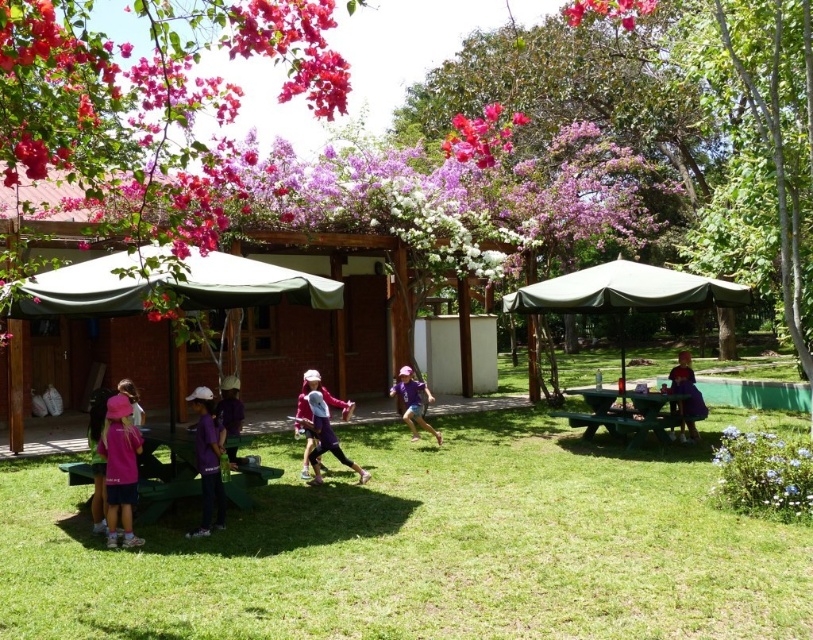
Who is positioned more to the left, green fabric canopy at center or green fabric canopy at right?

From the viewer's perspective, green fabric canopy at center appears more on the left side.

Is green fabric canopy at center behind green fabric canopy at right?

No.

Describe the element at coordinates (168, 284) in the screenshot. I see `green fabric canopy at center` at that location.

In order to click on green fabric canopy at center in this screenshot , I will do `click(168, 284)`.

Consider the image. Does vivid pink petals at upper center come behind purple fabric at right?

No, it is in front of purple fabric at right.

Find the location of `vivid pink petals at upper center`. vivid pink petals at upper center is located at coordinates (607, 10).

Looking at this image, does pink fabric at lower left have a larger size compared to purple fabric dress at center?

Incorrect, pink fabric at lower left is not larger than purple fabric dress at center.

Does pink fabric at lower left appear over purple fabric dress at center?

Correct, pink fabric at lower left is located above purple fabric dress at center.

You are a GUI agent. You are given a task and a screenshot of the screen. Output one action in this format:
    pyautogui.click(x=<x>, y=<y>)
    Task: Click on the pink fabric at lower left
    This screenshot has width=813, height=640.
    Given the screenshot: What is the action you would take?
    pyautogui.click(x=120, y=468)

Find the location of a particular element. This screenshot has height=640, width=813. pink fabric at lower left is located at coordinates (120, 468).